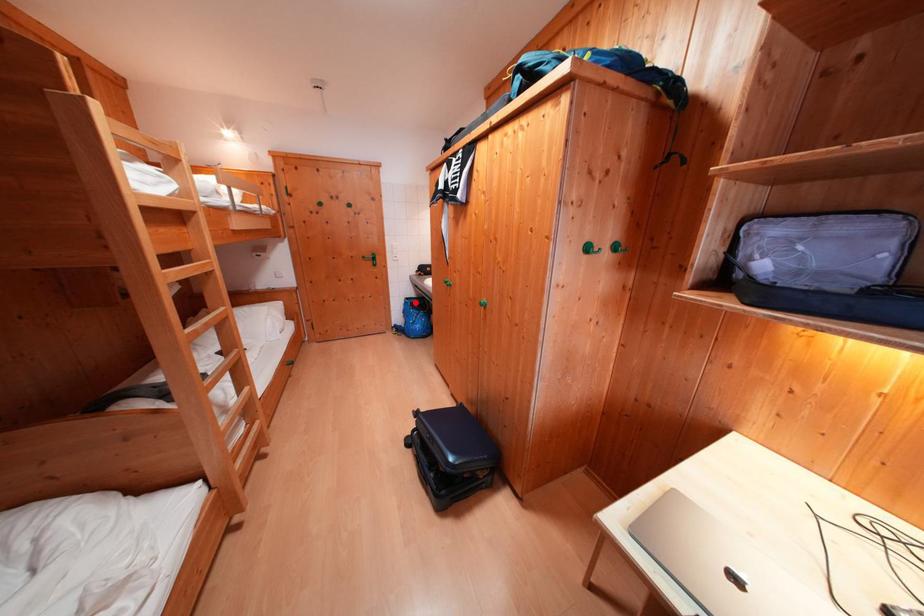
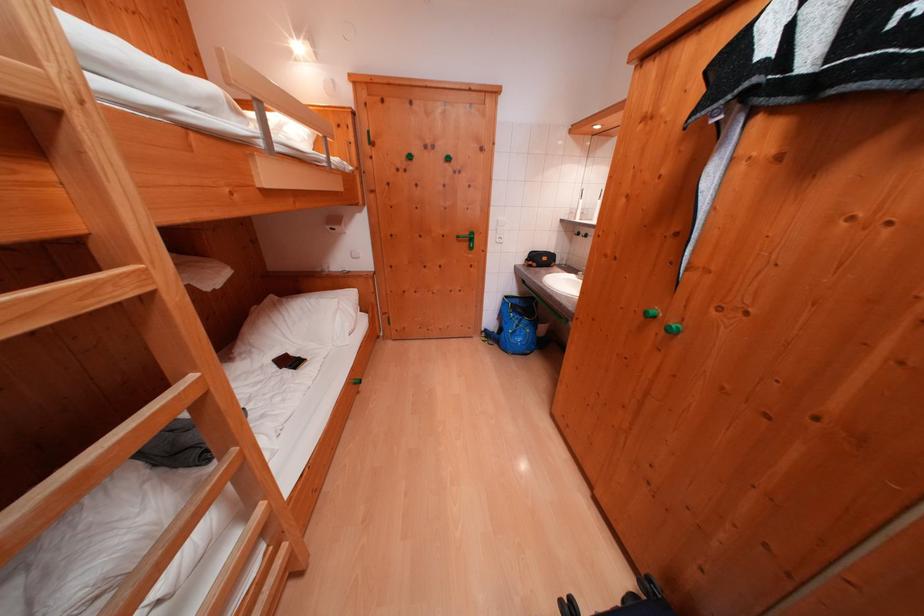
In the second image, find the point that corresponds to the highlighted location in the first image.

(515, 301)